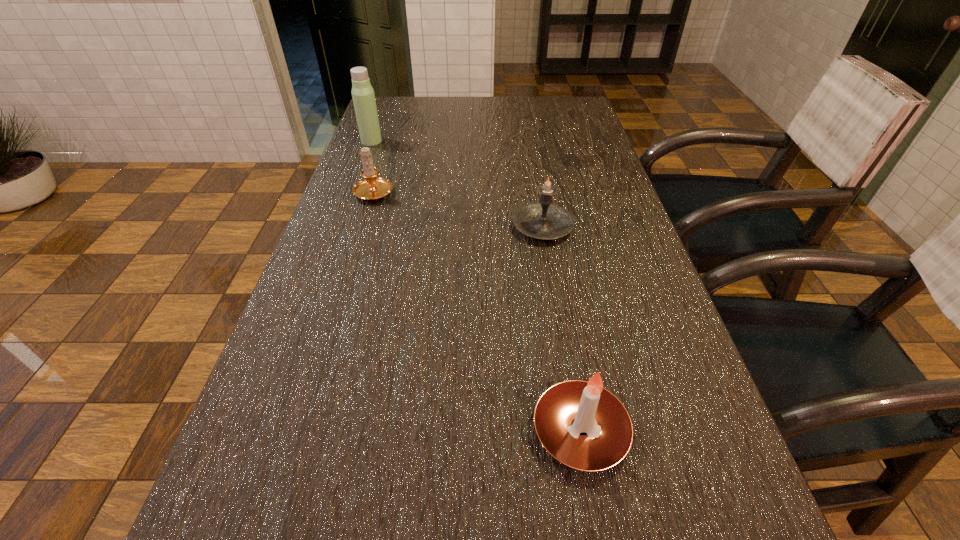
Where is `empty location between the nearest candle and the thermos bottle`? This screenshot has width=960, height=540. empty location between the nearest candle and the thermos bottle is located at coordinates (476, 286).

In order to click on free spot between the nearest object and the farthest candle in this screenshot , I will do `click(477, 311)`.

Where is `free space between the tallest object and the nearest object`? Image resolution: width=960 pixels, height=540 pixels. free space between the tallest object and the nearest object is located at coordinates (476, 286).

Identify the location of free space between the nearest object and the farthest candle. (477, 311).

You are a GUI agent. You are given a task and a screenshot of the screen. Output one action in this format:
    pyautogui.click(x=<x>, y=<y>)
    Task: Click on the free point between the nearest object and the thermos bottle
    The width and height of the screenshot is (960, 540).
    Given the screenshot: What is the action you would take?
    pyautogui.click(x=476, y=286)

The image size is (960, 540). Find the location of `vacant space in between the tallest object and the third farthest object`. vacant space in between the tallest object and the third farthest object is located at coordinates (457, 184).

You are a GUI agent. You are given a task and a screenshot of the screen. Output one action in this format:
    pyautogui.click(x=<x>, y=<y>)
    Task: Click on the object that is the second closest to the tallest object
    The image size is (960, 540).
    Given the screenshot: What is the action you would take?
    pyautogui.click(x=542, y=220)

Identify the location of object that is the third closest to the leftmost candle. (581, 424).

This screenshot has width=960, height=540. What are the coordinates of `candle that can be found as the closest to the leftmost candle` in the screenshot? It's located at (542, 220).

Where is `candle that stands as the closest to the nearest object`? candle that stands as the closest to the nearest object is located at coordinates click(542, 220).